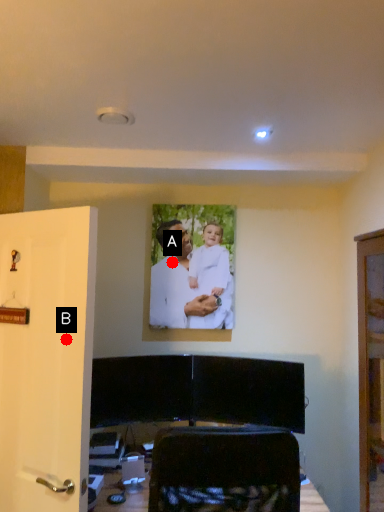
Question: Two points are circled on the image, labeled by A and B beside each circle. Which point is farther to the camera?

Choices:
 (A) A is further
 (B) B is further

Answer: (A)